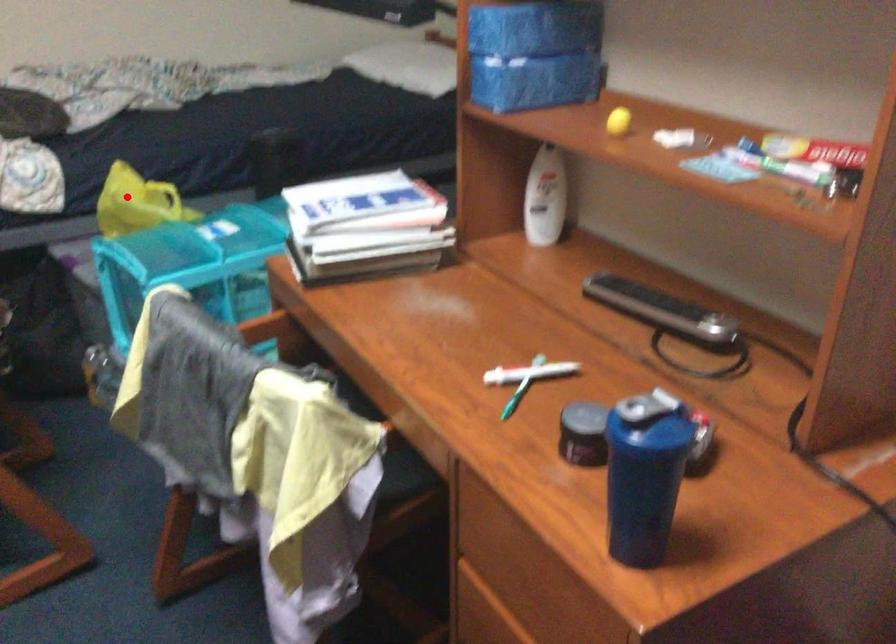
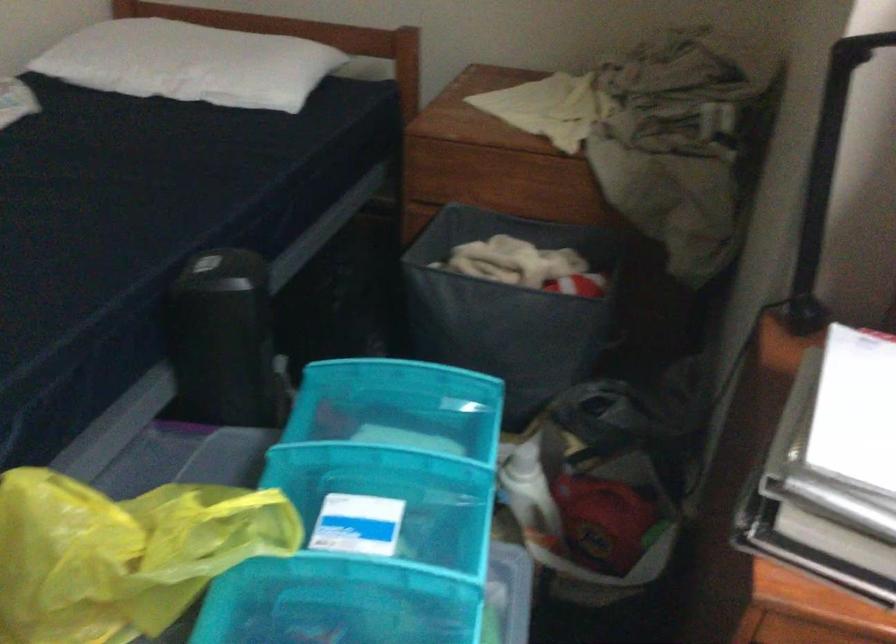
In the second image, find the point that corresponds to the highlighted location in the first image.

(122, 554)